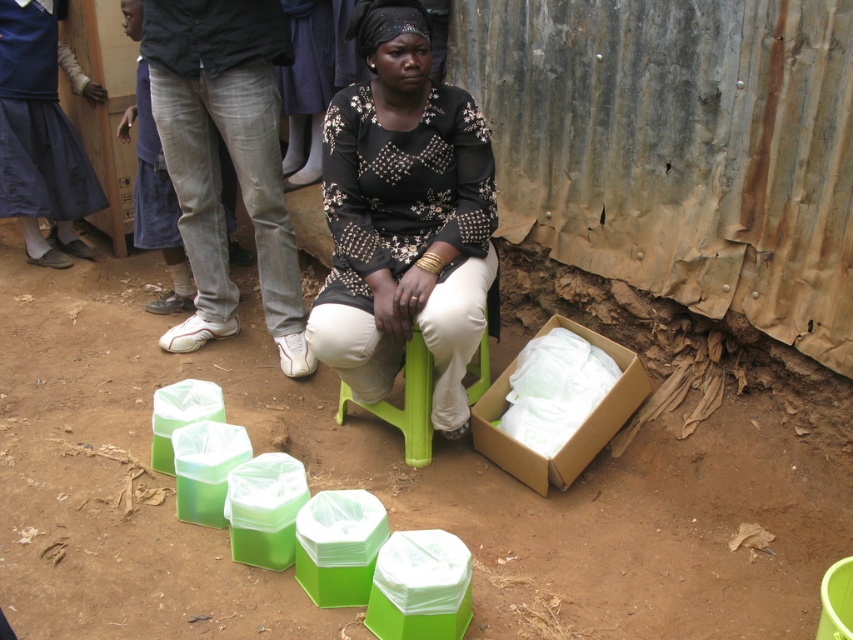
Is black sheer blouse at center positioned before brown cardboard box at lower right?

Yes, it is.

Is point (393, 160) farther from viewer compared to point (575, 429)?

No, (393, 160) is in front of (575, 429).

Identify the location of black sheer blouse at center. The height and width of the screenshot is (640, 853). (404, 218).

Who is more distant from viewer, (24,97) or (606,419)?

Positioned behind is point (24,97).

Can you confirm if blue fabric skirt at lower left is positioned to the left of brown cardboard box at lower right?

Indeed, blue fabric skirt at lower left is positioned on the left side of brown cardboard box at lower right.

Measure the distance between point (18, 113) and camera.

3.50 meters

Image resolution: width=853 pixels, height=640 pixels. Identify the location of blue fabric skirt at lower left. point(39,136).

Does black sheer blouse at center appear on the left side of blue fabric skirt at lower left?

Incorrect, black sheer blouse at center is not on the left side of blue fabric skirt at lower left.

Is black sheer blouse at center closer to the viewer compared to blue fabric skirt at lower left?

That is True.

Is point (407, 284) farther from viewer compared to point (78, 156)?

No, it is not.

The image size is (853, 640). I want to click on black sheer blouse at center, so coord(404,218).